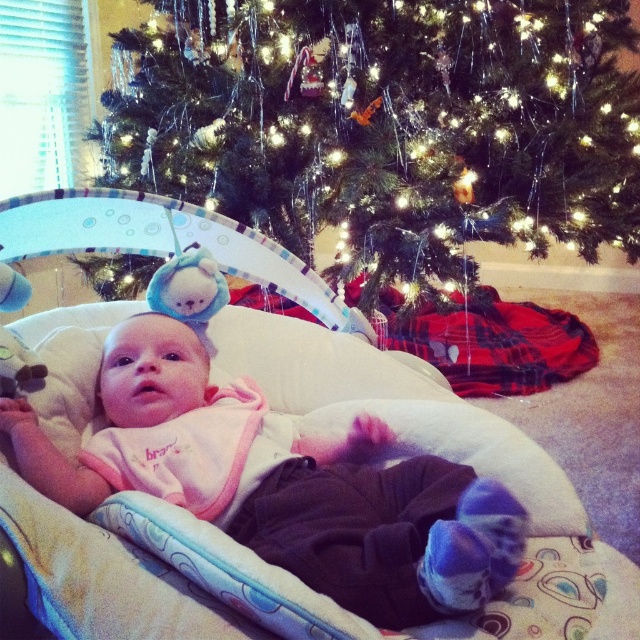
You are a parent trying to ensure the baby stays within a safe area. The play mat is placed between the baby and the Christmas tree. Based on the scene, which object is wider, the green matte christmas tree at center or the pink fleece baby at center?

The green matte christmas tree at center is wider than the pink fleece baby at center according to the description.

Consider the image. You are a parent who wants to ensure the baby is safe while playing. The baby is on a play mat near the Christmas tree. Given that the baby can reach about 2 feet, is the green matte christmas tree at center within the baby pink fleece baby at center reach?

The green matte christmas tree at center is 3.64 feet from the pink fleece baby at center. Since the baby can reach about 2 feet, the distance between them is greater than the baby can reach. Therefore, the green matte christmas tree at center is out of the baby pink fleece baby at center reach.

You are a parent looking at the image. You want to ensure the baby is safe from the Christmas tree. Based on the scene, is the green matte Christmas tree at center blocking the parent from seeing the pink fleece baby at center?

The green matte Christmas tree at center is positioned over the pink fleece baby at center, so the tree is blocking the parent from seeing the baby directly.